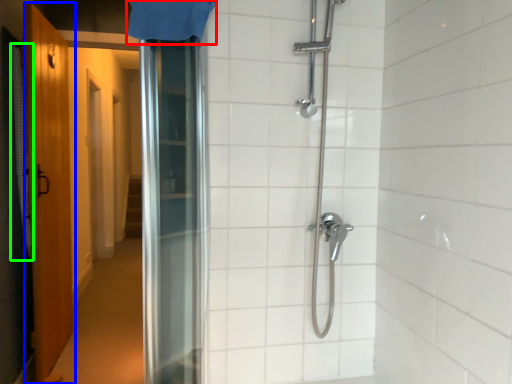
Question: Based on their relative distances, which object is farther from shower curtain (highlighted by a red box)? Choose from door (highlighted by a blue box) and shower curtain (highlighted by a green box).

Choices:
 (A) door
 (B) shower curtain

Answer: (A)